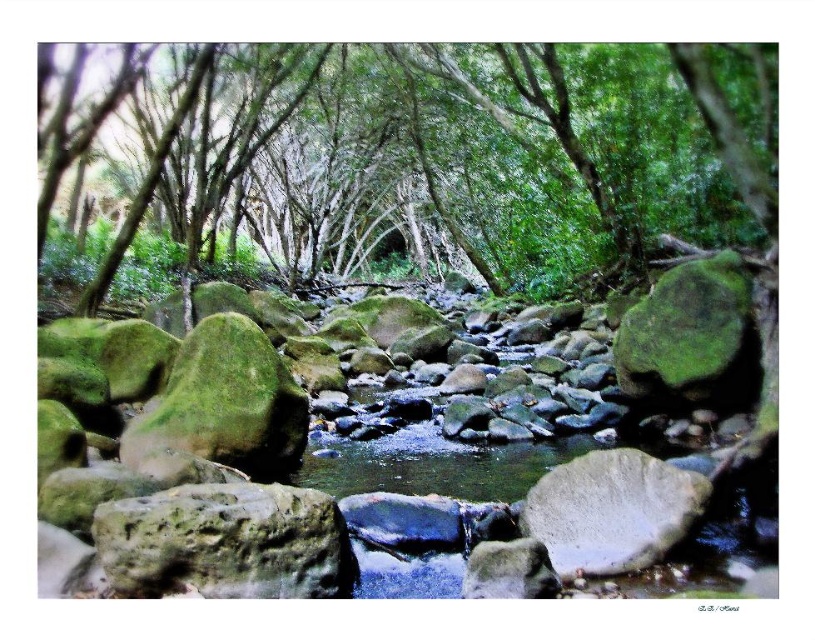
Is green mossy tree at center below green mossy rock at lower left?

Actually, green mossy tree at center is above green mossy rock at lower left.

Is point (217, 77) behind point (247, 493)?

Yes.

Is point (644, 109) farther from viewer compared to point (311, 568)?

Yes.

Identify the location of green mossy tree at center. (457, 160).

Measure the distance between point (408, 113) and camera.

A distance of 63.76 feet exists between point (408, 113) and camera.

Is green mossy tree at center to the right of white smooth rock at center from the viewer's perspective?

Incorrect, green mossy tree at center is not on the right side of white smooth rock at center.

Between point (576, 150) and point (624, 508), which one is positioned behind?

The point (576, 150) is behind.

The height and width of the screenshot is (640, 815). In order to click on green mossy tree at center in this screenshot , I will do `click(457, 160)`.

Which is more to the left, green mossy rock at lower left or white smooth rock at center?

green mossy rock at lower left is more to the left.

Is green mossy rock at lower left further to camera compared to white smooth rock at center?

No, green mossy rock at lower left is closer to the viewer.

Which is in front, point (342, 516) or point (557, 490)?

Point (342, 516) is more forward.

This screenshot has height=640, width=815. What are the coordinates of `green mossy rock at lower left` in the screenshot? It's located at (225, 541).